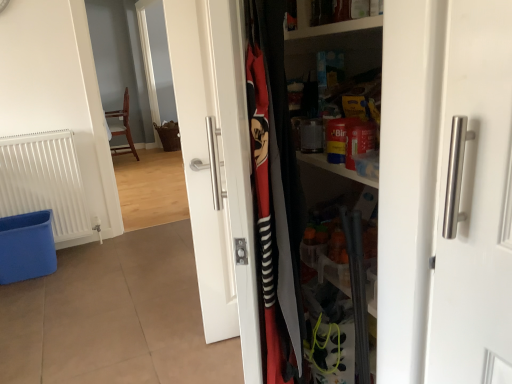
Measure the distance between point (12, 177) and camera.

The depth of point (12, 177) is 9.00 feet.

Image resolution: width=512 pixels, height=384 pixels. Describe the element at coordinates (45, 182) in the screenshot. I see `white ribbed radiator at left` at that location.

The width and height of the screenshot is (512, 384). I want to click on white ribbed radiator at left, so click(x=45, y=182).

Find the location of a particular element. Image resolution: width=512 pixels, height=384 pixels. white ribbed radiator at left is located at coordinates (45, 182).